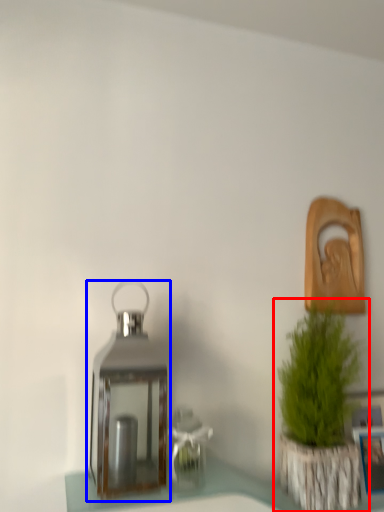
Question: Which object appears closest to the camera in this image, houseplant (highlighted by a red box) or lantern (highlighted by a blue box)?

Choices:
 (A) houseplant
 (B) lantern

Answer: (B)